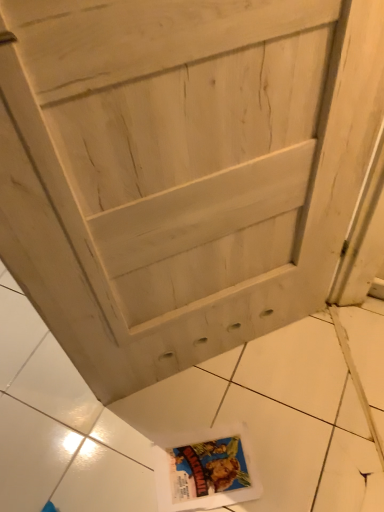
Locate an element on the screen. matte paper book cover at lower center is located at coordinates (206, 472).

Image resolution: width=384 pixels, height=512 pixels. Describe the element at coordinates (206, 472) in the screenshot. I see `matte paper book cover at lower center` at that location.

What is the approximate height of matte paper book cover at lower center?

matte paper book cover at lower center is 0.86 inches in height.

Locate an element on the screen. The height and width of the screenshot is (512, 384). matte paper book cover at lower center is located at coordinates pos(206,472).